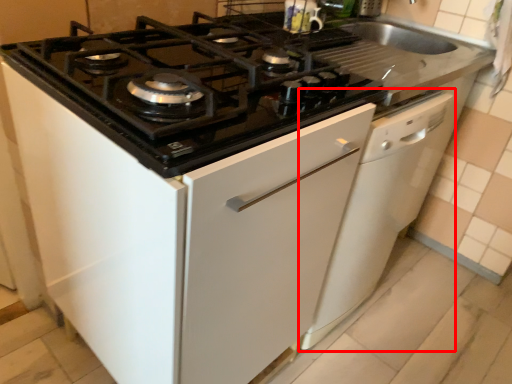
Question: Where is dish washer (annotated by the red box) located in relation to gas stove in the image?

Choices:
 (A) left
 (B) right

Answer: (B)